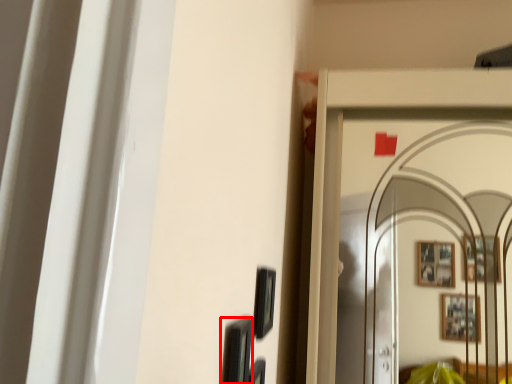
Question: Considering the relative positions of picture frame (annotated by the red box) and picture frame in the image provided, where is picture frame (annotated by the red box) located with respect to the staircase?

Choices:
 (A) right
 (B) left

Answer: (B)